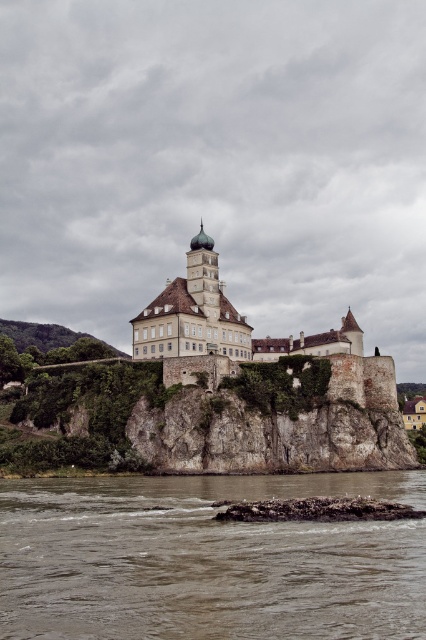
Question: Among these objects, which one is farthest from the camera?

Choices:
 (A) brown sedimentary rock at lower center
 (B) white stone castle at center

Answer: (B)

Question: Considering the relative positions of brown sedimentary rock at lower center and white stone castle at center in the image provided, where is brown sedimentary rock at lower center located with respect to white stone castle at center?

Choices:
 (A) above
 (B) below

Answer: (B)

Question: Which object appears farthest from the camera in this image?

Choices:
 (A) brown sedimentary rock at lower center
 (B) white stone castle at center

Answer: (B)

Question: Does brown sedimentary rock at lower center appear on the left side of white stone castle at center?

Choices:
 (A) yes
 (B) no

Answer: (A)

Question: Does brown sedimentary rock at lower center have a greater width compared to white stone castle at center?

Choices:
 (A) yes
 (B) no

Answer: (A)